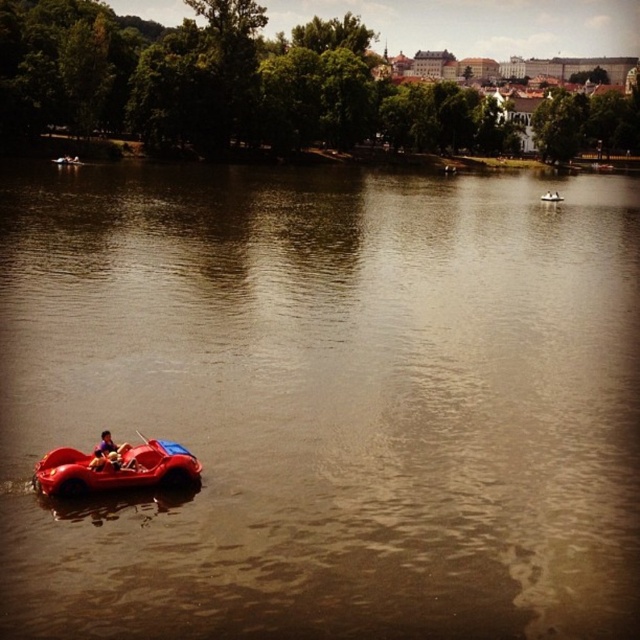
Can you confirm if red rubber boat at lower left is taller than matte red pedal boat at center?

Indeed, red rubber boat at lower left has a greater height compared to matte red pedal boat at center.

Can you confirm if red rubber boat at lower left is thinner than matte red pedal boat at center?

In fact, red rubber boat at lower left might be wider than matte red pedal boat at center.

This screenshot has height=640, width=640. What do you see at coordinates (67, 161) in the screenshot?
I see `red rubber boat at lower left` at bounding box center [67, 161].

The image size is (640, 640). I want to click on red rubber boat at lower left, so click(67, 161).

Is shiny red car at lower left to the left of matte red pedal boat at center from the viewer's perspective?

Indeed, shiny red car at lower left is positioned on the left side of matte red pedal boat at center.

Based on the photo, between shiny red car at lower left and matte red pedal boat at center, which one has more height?

With more height is matte red pedal boat at center.

Is point (35, 472) more distant than point (547, 196)?

That is False.

This screenshot has height=640, width=640. Find the location of `shiny red car at lower left`. shiny red car at lower left is located at coordinates (116, 468).

Is shiny red car at lower left positioned at the back of smooth plastic paddle boat at lower left?

No, shiny red car at lower left is in front of smooth plastic paddle boat at lower left.

Who is positioned more to the right, shiny red car at lower left or smooth plastic paddle boat at lower left?

Positioned to the right is shiny red car at lower left.

I want to click on shiny red car at lower left, so click(x=116, y=468).